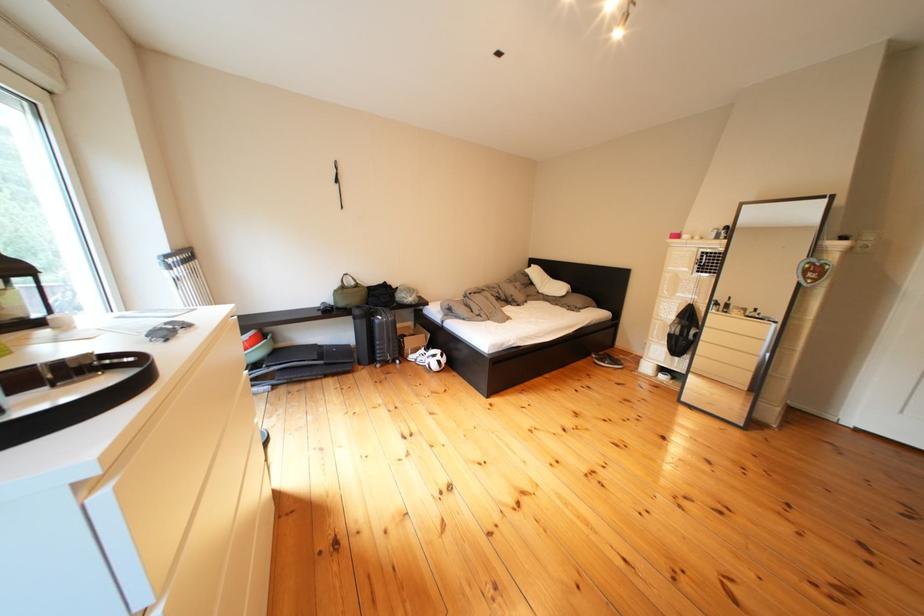
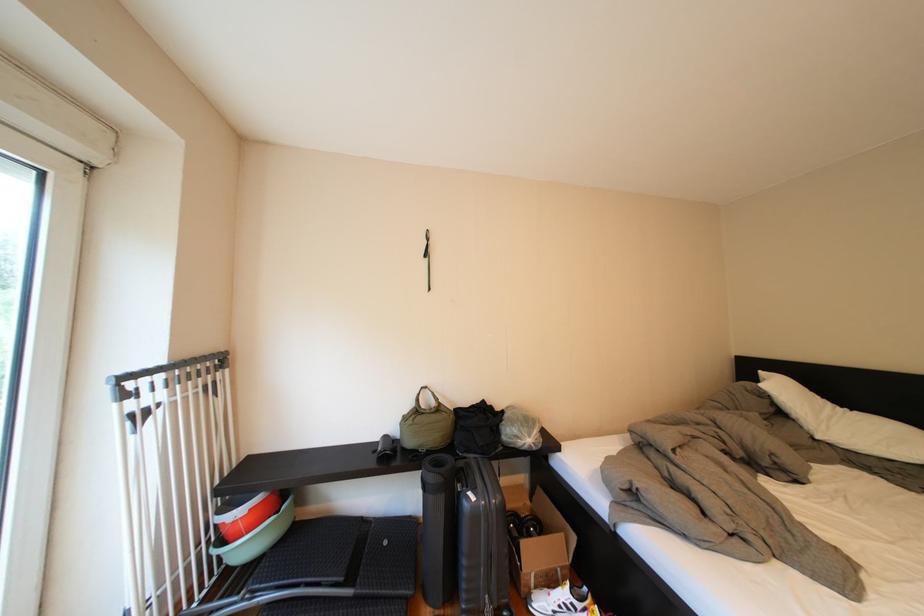
The images are taken continuously from a first-person perspective. In which direction are you moving?

The movement direction of the cameraman is left, forward.